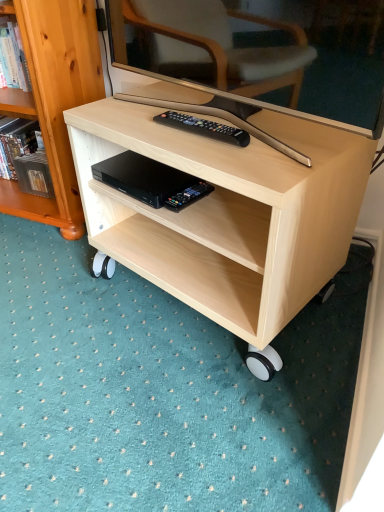
Question: Does light wood/texture bookcase at left have a greater height compared to light wood desk at center?

Choices:
 (A) yes
 (B) no

Answer: (A)

Question: Would you say light wood/texture bookcase at left is a long distance from light wood desk at center?

Choices:
 (A) yes
 (B) no

Answer: (B)

Question: Is light wood/texture bookcase at left in front of light wood desk at center?

Choices:
 (A) yes
 (B) no

Answer: (B)

Question: Can you see light wood/texture bookcase at left touching light wood desk at center?

Choices:
 (A) no
 (B) yes

Answer: (A)

Question: Can you confirm if light wood/texture bookcase at left is smaller than light wood desk at center?

Choices:
 (A) yes
 (B) no

Answer: (B)

Question: Based on their sizes in the image, would you say black plastic remote at center is bigger or smaller than black plastic remote control at lower center?

Choices:
 (A) small
 (B) big

Answer: (A)

Question: Is black plastic remote at center situated inside black plastic remote control at lower center or outside?

Choices:
 (A) inside
 (B) outside

Answer: (B)

Question: Is point (233, 129) closer or farther from the camera than point (205, 188)?

Choices:
 (A) farther
 (B) closer

Answer: (B)

Question: From the image's perspective, is black plastic remote at center located above or below black plastic remote control at lower center?

Choices:
 (A) above
 (B) below

Answer: (A)

Question: In the image, is light wood/texture bookcase at left on the left side or the right side of black plastic remote control at lower center?

Choices:
 (A) left
 (B) right

Answer: (A)

Question: From the image's perspective, relative to black plastic remote control at lower center, is light wood/texture bookcase at left above or below?

Choices:
 (A) below
 (B) above

Answer: (B)

Question: From a real-world perspective, relative to black plastic remote control at lower center, is light wood/texture bookcase at left vertically above or below?

Choices:
 (A) above
 (B) below

Answer: (A)

Question: Is light wood/texture bookcase at left in front of or behind black plastic remote control at lower center in the image?

Choices:
 (A) front
 (B) behind

Answer: (B)

Question: From the image's perspective, relative to light wood/texture bookcase at left, is black plastic remote control at lower center above or below?

Choices:
 (A) above
 (B) below

Answer: (B)

Question: Which is correct: black plastic remote control at lower center is inside light wood/texture bookcase at left, or outside of it?

Choices:
 (A) inside
 (B) outside

Answer: (B)